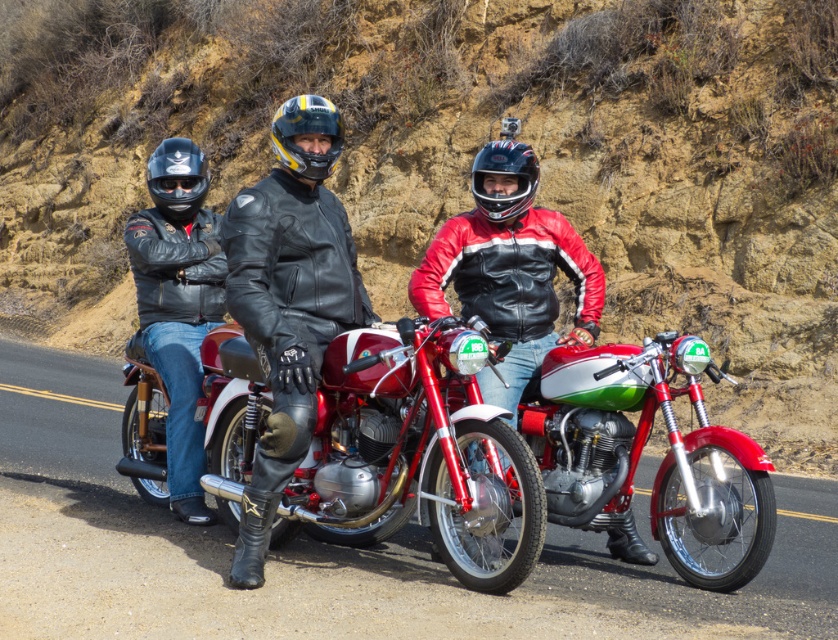
Question: Among these points, which one is farthest from the camera?

Choices:
 (A) (293, 112)
 (B) (328, 330)

Answer: (B)

Question: Does dull brown dirt at center come behind black matte helmet at center?

Choices:
 (A) yes
 (B) no

Answer: (A)

Question: Is dull brown dirt at center positioned before shiny chrome motorcycle at center?

Choices:
 (A) no
 (B) yes

Answer: (A)

Question: Does red leather jacket at center lie in front of yellow matte helmet at center?

Choices:
 (A) yes
 (B) no

Answer: (B)

Question: Which point appears farthest from the camera in this image?

Choices:
 (A) (330, 145)
 (B) (436, 396)

Answer: (A)

Question: Which point is closer to the camera?

Choices:
 (A) black matte helmet at center
 (B) yellow matte helmet at center
 (C) matte black helmet at left
 (D) black matte goggles at center

Answer: (B)